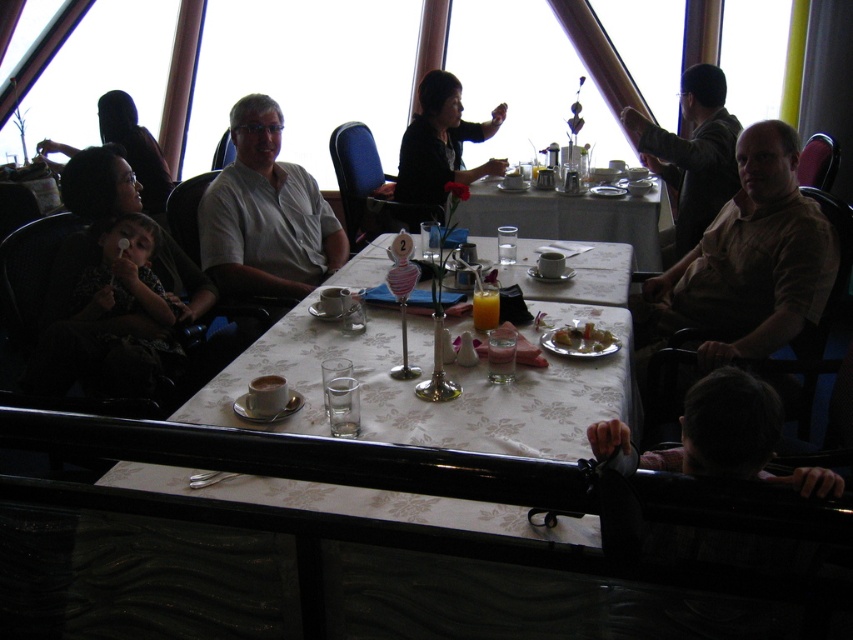
Is brown textured shirt at right further to camera compared to shiny silver plate at table center?

That is True.

Locate an element on the screen. The width and height of the screenshot is (853, 640). brown textured shirt at right is located at coordinates (747, 262).

Find the location of `brown textured shirt at right`. brown textured shirt at right is located at coordinates (747, 262).

Can you confirm if brown textured shirt at right is positioned to the left of white shirt at center?

No, brown textured shirt at right is not to the left of white shirt at center.

Identify the location of brown textured shirt at right. This screenshot has height=640, width=853. (747, 262).

Does matte black child at left appear on the left side of translucent glass juice at table center?

Indeed, matte black child at left is positioned on the left side of translucent glass juice at table center.

Locate an element on the screen. Image resolution: width=853 pixels, height=640 pixels. matte black child at left is located at coordinates (99, 186).